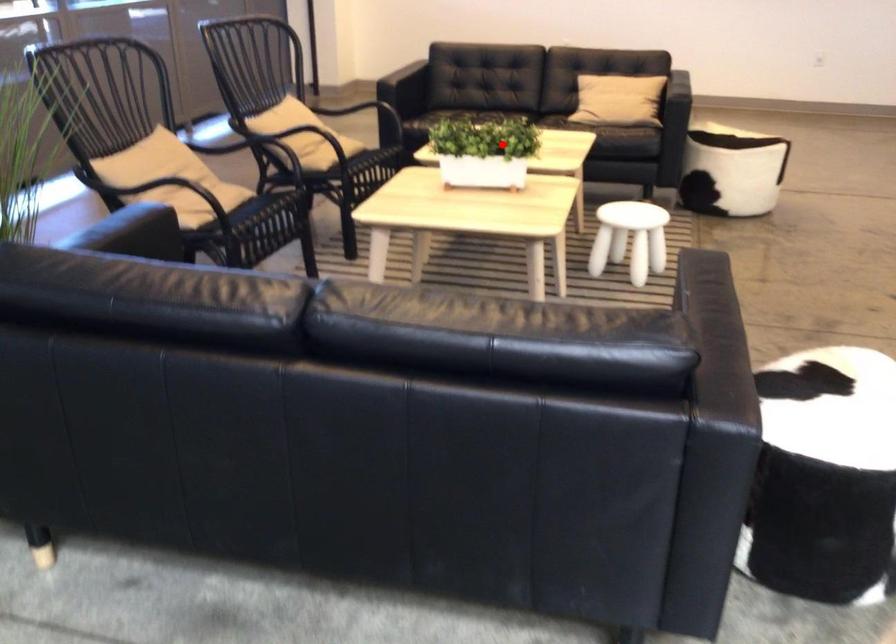
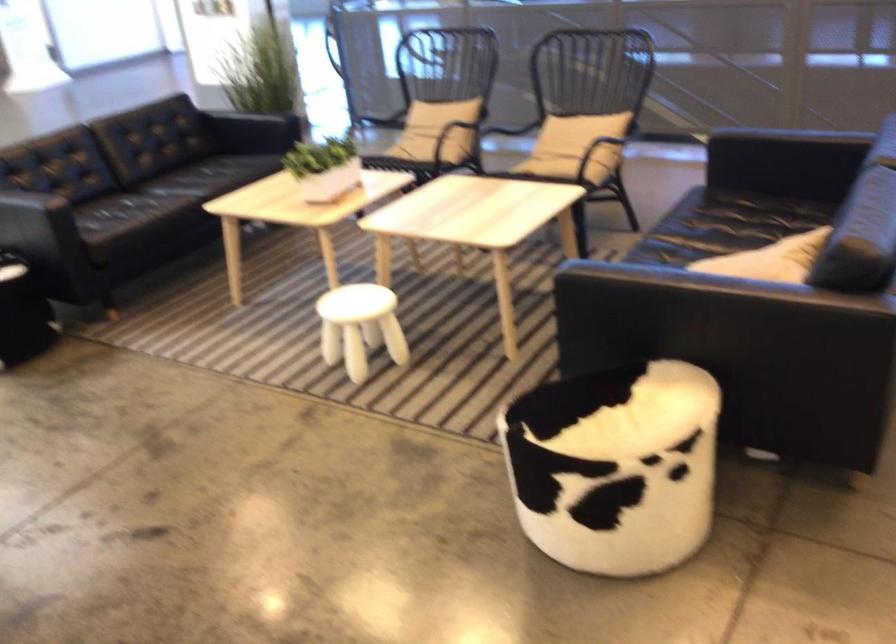
Find the pixel in the second image that matches the highlighted location in the first image.

(323, 167)